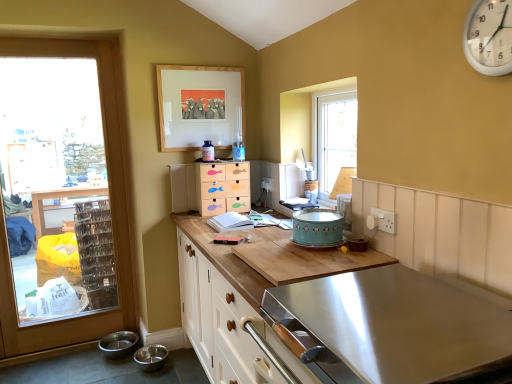
Question: From a real-world perspective, does wooden drawers at center, the first appliance when ordered from top to bottom, sit lower than wooden cutting board at center, which appears as the first countertop when viewed from the top?

Choices:
 (A) yes
 (B) no

Answer: (B)

Question: Considering the relative positions of wooden drawers at center, which ranks as the first appliance in back-to-front order, and wooden cutting board at center, which appears as the first countertop when viewed from the top, in the image provided, is wooden drawers at center, which ranks as the first appliance in back-to-front order, to the right of wooden cutting board at center, which appears as the first countertop when viewed from the top, from the viewer's perspective?

Choices:
 (A) no
 (B) yes

Answer: (A)

Question: From a real-world perspective, does wooden drawers at center, which ranks as the first appliance in back-to-front order, stand above wooden cutting board at center, which appears as the first countertop when viewed from the top?

Choices:
 (A) yes
 (B) no

Answer: (A)

Question: Is wooden drawers at center, the 1th appliance when ordered from left to right, located outside wooden cutting board at center, acting as the 2th countertop starting from the bottom?

Choices:
 (A) no
 (B) yes

Answer: (B)

Question: Does wooden drawers at center, the first appliance when ordered from top to bottom, have a smaller size compared to wooden cutting board at center, which appears as the first countertop when viewed from the top?

Choices:
 (A) yes
 (B) no

Answer: (A)

Question: Does wooden drawers at center, the 2th appliance from the right, lie in front of wooden cutting board at center, which appears as the first countertop when viewed from the top?

Choices:
 (A) yes
 (B) no

Answer: (B)

Question: Can you confirm if teal matte cake stand at center, acting as the second appliance starting from the back, is shorter than white plastic clock at upper right?

Choices:
 (A) yes
 (B) no

Answer: (A)

Question: Can you confirm if teal matte cake stand at center, which ranks as the 1th appliance in right-to-left order, is wider than white plastic clock at upper right?

Choices:
 (A) yes
 (B) no

Answer: (A)

Question: From a real-world perspective, is teal matte cake stand at center, acting as the second appliance starting from the top, on white plastic clock at upper right?

Choices:
 (A) yes
 (B) no

Answer: (B)

Question: Does teal matte cake stand at center, the 1th appliance viewed from the front, have a smaller size compared to white plastic clock at upper right?

Choices:
 (A) yes
 (B) no

Answer: (B)

Question: Would you say white plastic clock at upper right is part of teal matte cake stand at center, acting as the second appliance starting from the top,'s contents?

Choices:
 (A) yes
 (B) no

Answer: (B)

Question: Is teal matte cake stand at center, which ranks as the 1th appliance in right-to-left order, not within white plastic clock at upper right?

Choices:
 (A) yes
 (B) no

Answer: (A)

Question: Is white plastic clock at upper right smaller than wooden drawers at center, the 1th appliance when ordered from left to right?

Choices:
 (A) yes
 (B) no

Answer: (A)